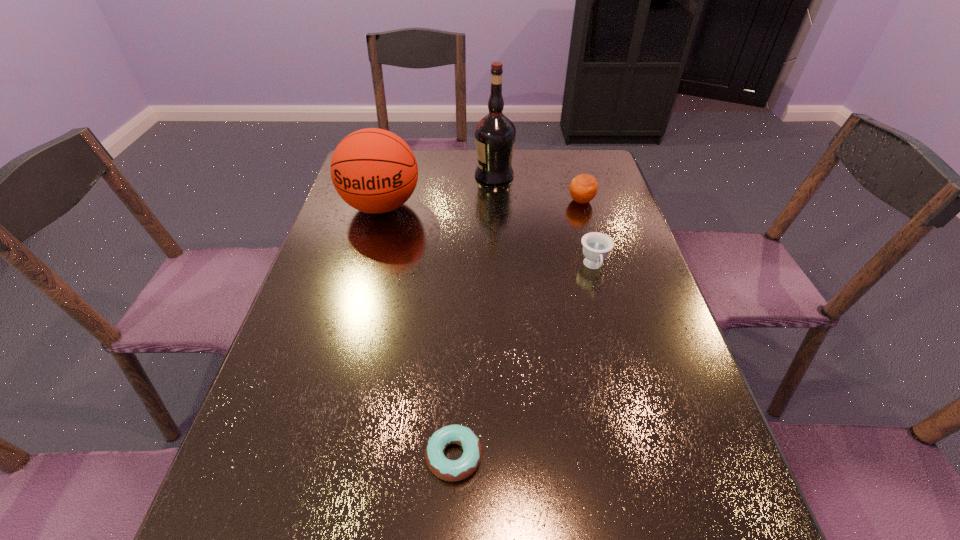
Identify the location of vacant space located on the surface of the liquor. This screenshot has height=540, width=960. (432, 175).

Identify the location of vacant space located 0.130m on the side with logo of the second tallest object. point(366,261).

You are a GUI agent. You are given a task and a screenshot of the screen. Output one action in this format:
    pyautogui.click(x=<x>, y=<y>)
    Task: Click on the vacant position located 0.080m on the left of the orange
    The image size is (960, 540).
    Given the screenshot: What is the action you would take?
    pyautogui.click(x=541, y=201)

Identify the location of free space located 0.120m on the side of the second nearest object with the handle. (608, 317).

You are a GUI agent. You are given a task and a screenshot of the screen. Output one action in this format:
    pyautogui.click(x=<x>, y=<y>)
    Task: Click on the free space located on the left of the shortest object
    Image resolution: width=960 pixels, height=540 pixels.
    Given the screenshot: What is the action you would take?
    pyautogui.click(x=325, y=456)

Locate an element on the screen. The width and height of the screenshot is (960, 540). liquor that is at the far edge is located at coordinates (495, 134).

Identify the location of basketball present at the far edge. (373, 170).

Locate an element on the screen. The width and height of the screenshot is (960, 540). object that is positioned at the left edge is located at coordinates (373, 170).

Where is `orange located in the right edge section of the desktop`? The image size is (960, 540). orange located in the right edge section of the desktop is located at coordinates (583, 188).

Locate an element on the screen. This screenshot has width=960, height=540. teacup located in the right edge section of the desktop is located at coordinates (596, 246).